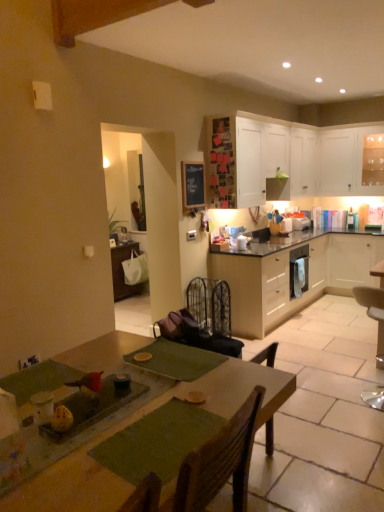
Where is `vacant region to the left of metallic silver chair at lower right`? The height and width of the screenshot is (512, 384). vacant region to the left of metallic silver chair at lower right is located at coordinates (324, 400).